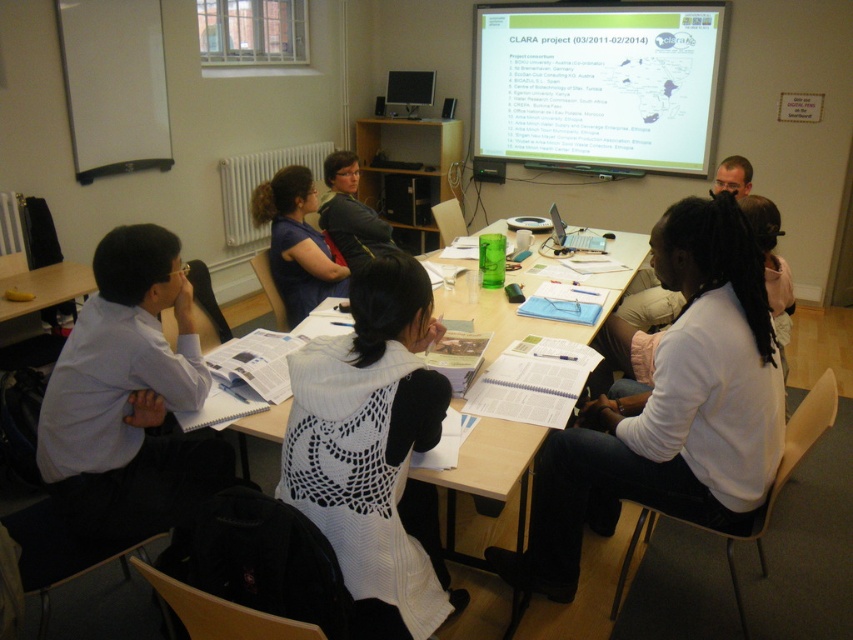
Question: Which point is closer to the camera?

Choices:
 (A) (343, 292)
 (B) (459, 492)

Answer: (B)

Question: Which point appears closest to the camera in this image?

Choices:
 (A) (148, 262)
 (B) (495, 435)
 (C) (363, 268)
 (D) (726, 436)

Answer: (C)

Question: Which object is closer to the camera taking this photo?

Choices:
 (A) matte black sweater at center
 (B) white knitted vest at center
 (C) white glossy projector screen at upper center
 (D) white shirt at left

Answer: (B)

Question: Can you confirm if white knitted vest at center is positioned above matte black sweater at center?

Choices:
 (A) no
 (B) yes

Answer: (A)

Question: Can you confirm if white knit sweater at center is positioned to the left of white glossy projector screen at upper center?

Choices:
 (A) no
 (B) yes

Answer: (B)

Question: Does white knit sweater at center have a lesser width compared to white knitted vest at center?

Choices:
 (A) yes
 (B) no

Answer: (B)